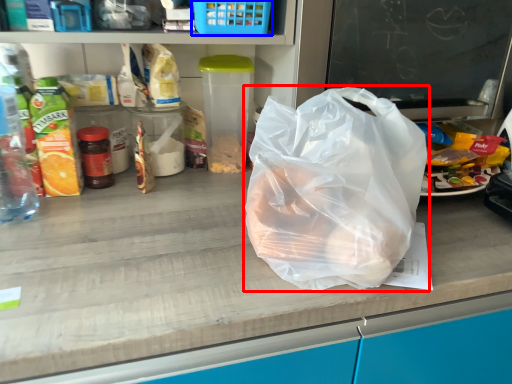
Question: Which point is closer to the camera, plastic bag (highlighted by a red box) or basket (highlighted by a blue box)?

Choices:
 (A) plastic bag
 (B) basket

Answer: (A)